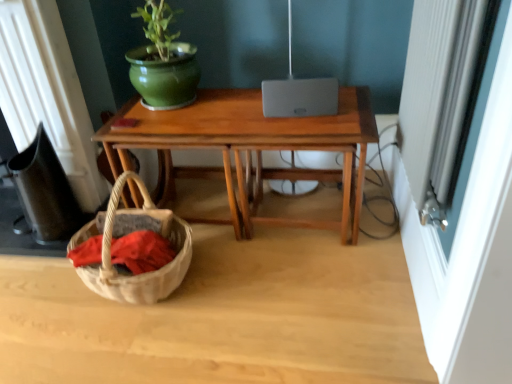
Question: From the image's perspective, is satin silver lamp at center located above or below white textured screen door at right?

Choices:
 (A) below
 (B) above

Answer: (B)

Question: Would you say satin silver lamp at center is to the left or to the right of white textured screen door at right in the picture?

Choices:
 (A) right
 (B) left

Answer: (B)

Question: Estimate the real-world distances between objects in this image. Which object is closer to the white textured screen door at right?

Choices:
 (A) satin silver lamp at center
 (B) wooden desk at center

Answer: (B)

Question: Which object is positioned closest to the white textured screen door at right?

Choices:
 (A) satin silver lamp at center
 (B) wooden desk at center

Answer: (B)